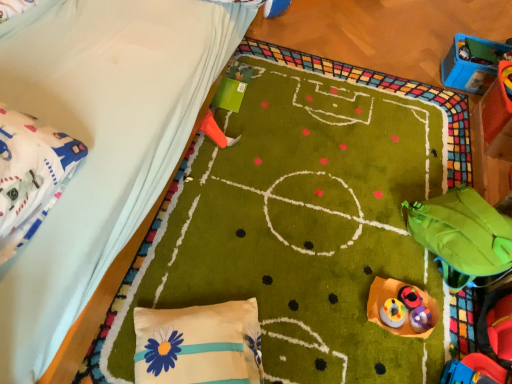
Question: Is rubberized plastic toy at center, placed as the 3th toy when sorted from right to left, outside rubberized plastic toy at lower right, placed as the 2th toy when sorted from right to left?

Choices:
 (A) yes
 (B) no

Answer: (A)

Question: Would you say rubberized plastic toy at center, the fourth toy in the front-to-back sequence, contains rubberized plastic toy at lower right, which is counted as the 6th toy, starting from the top?

Choices:
 (A) yes
 (B) no

Answer: (B)

Question: Does rubberized plastic toy at center, placed as the 3th toy when sorted from right to left, have a greater width compared to rubberized plastic toy at lower right, which appears as the 3th toy when viewed from the front?

Choices:
 (A) yes
 (B) no

Answer: (B)

Question: Does rubberized plastic toy at center, the third toy when ordered from back to front, come behind rubberized plastic toy at lower right, placed as the 2th toy when sorted from right to left?

Choices:
 (A) no
 (B) yes

Answer: (B)

Question: From a real-world perspective, is rubberized plastic toy at center, the fourth toy in the front-to-back sequence, beneath rubberized plastic toy at lower right, the 1th toy when ordered from bottom to top?

Choices:
 (A) yes
 (B) no

Answer: (B)

Question: Is rubberized plastic toy at center, placed as the fourth toy when sorted from bottom to top, positioned before rubberized plastic toy at lower right, the 1th toy when ordered from bottom to top?

Choices:
 (A) no
 (B) yes

Answer: (A)

Question: Is white satin pillow with blue flower at lower center wider than green fabric bean bag at lower right?

Choices:
 (A) yes
 (B) no

Answer: (B)

Question: From a real-world perspective, is white satin pillow with blue flower at lower center physically below green fabric bean bag at lower right?

Choices:
 (A) no
 (B) yes

Answer: (B)

Question: From a real-world perspective, is white satin pillow with blue flower at lower center on top of green fabric bean bag at lower right?

Choices:
 (A) no
 (B) yes

Answer: (A)

Question: From the image's perspective, is white satin pillow with blue flower at lower center below green fabric bean bag at lower right?

Choices:
 (A) no
 (B) yes

Answer: (B)

Question: Is white satin pillow with blue flower at lower center shorter than green fabric bean bag at lower right?

Choices:
 (A) no
 (B) yes

Answer: (B)

Question: Is white satin pillow with blue flower at lower center facing away from green fabric bean bag at lower right?

Choices:
 (A) no
 (B) yes

Answer: (A)

Question: Does blue plastic toy at upper right, the 1th toy when ordered from back to front, have a greater height compared to rubberized plastic toy at center, placed as the 3th toy when sorted from right to left?

Choices:
 (A) no
 (B) yes

Answer: (B)